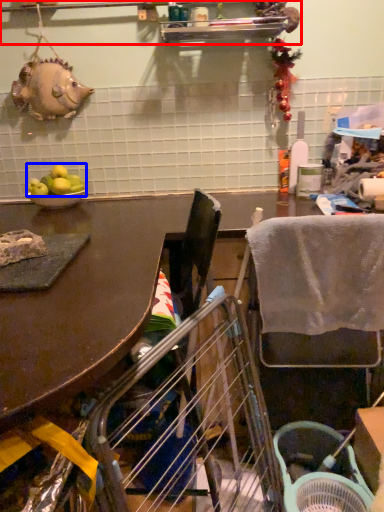
Question: Which point is further to the camera, shelf (highlighted by a red box) or fruit (highlighted by a blue box)?

Choices:
 (A) shelf
 (B) fruit

Answer: (B)